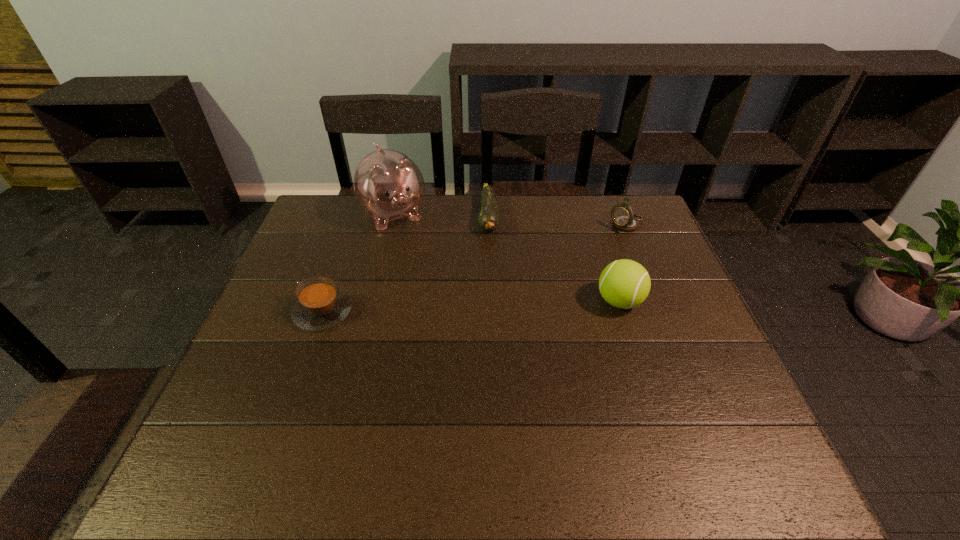
Image resolution: width=960 pixels, height=540 pixels. Identify the location of object located in the left edge section of the desktop. tap(320, 305).

The width and height of the screenshot is (960, 540). What are the coordinates of `tennis ball present at the right edge` in the screenshot? It's located at (624, 284).

At what (x,y) coordinates should I click in order to perform the action: click on compass at the right edge. Please return your answer as a coordinate pair (x, y). This screenshot has width=960, height=540. Looking at the image, I should click on 624,219.

I want to click on object that is at the far right corner, so click(624, 219).

Where is `vacant space at the far edge of the desktop`? Image resolution: width=960 pixels, height=540 pixels. vacant space at the far edge of the desktop is located at coordinates (579, 234).

The image size is (960, 540). In the image, there is a desktop. In order to click on vacant region at the near edge in this screenshot , I will do `click(564, 424)`.

This screenshot has height=540, width=960. In the image, there is a desktop. Find the location of `vacant space at the right edge`. vacant space at the right edge is located at coordinates (660, 263).

This screenshot has width=960, height=540. Find the location of `vacant space at the far left corner of the desktop`. vacant space at the far left corner of the desktop is located at coordinates (339, 206).

In the image, there is a desktop. Where is `vacant space at the near left corner`? Image resolution: width=960 pixels, height=540 pixels. vacant space at the near left corner is located at coordinates [x=221, y=418].

At what (x,y) coordinates should I click in order to perform the action: click on vacant region at the far right corner of the desktop. Please return your answer as a coordinate pair (x, y). The width and height of the screenshot is (960, 540). Looking at the image, I should click on (623, 197).